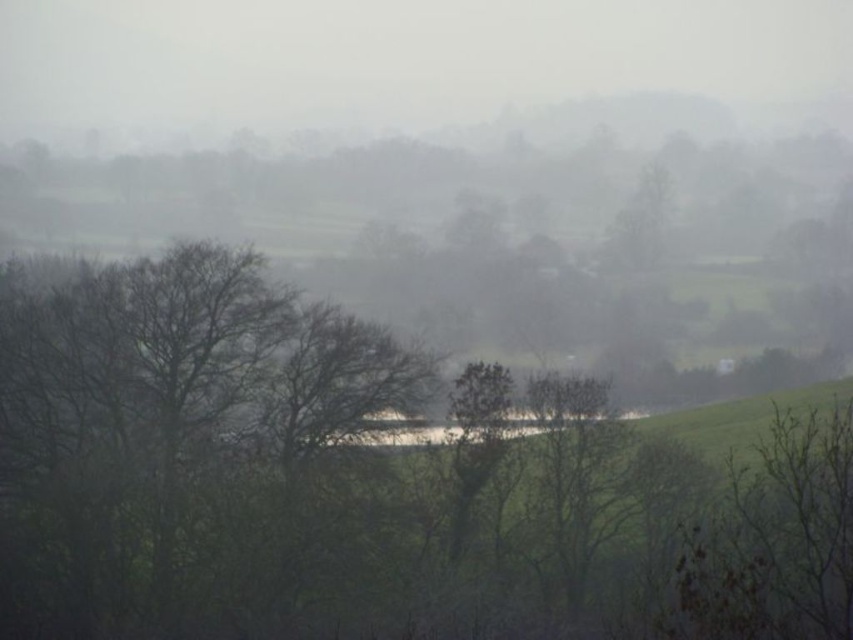
Question: Is green matte tree at lower right to the right of green leafy tree at center from the viewer's perspective?

Choices:
 (A) yes
 (B) no

Answer: (A)

Question: Which point is farther to the camera?

Choices:
 (A) (689, 529)
 (B) (782, 509)
 (C) (494, 449)

Answer: (C)

Question: Is green matte tree at lower right smaller than green leafy tree at center?

Choices:
 (A) yes
 (B) no

Answer: (B)

Question: Which point is closer to the camera?

Choices:
 (A) (199, 417)
 (B) (461, 477)

Answer: (B)

Question: Among these objects, which one is nearest to the camera?

Choices:
 (A) green matte tree at lower right
 (B) green matte tree at center

Answer: (A)

Question: Is green matte tree at center below green matte tree at lower right?

Choices:
 (A) yes
 (B) no

Answer: (A)